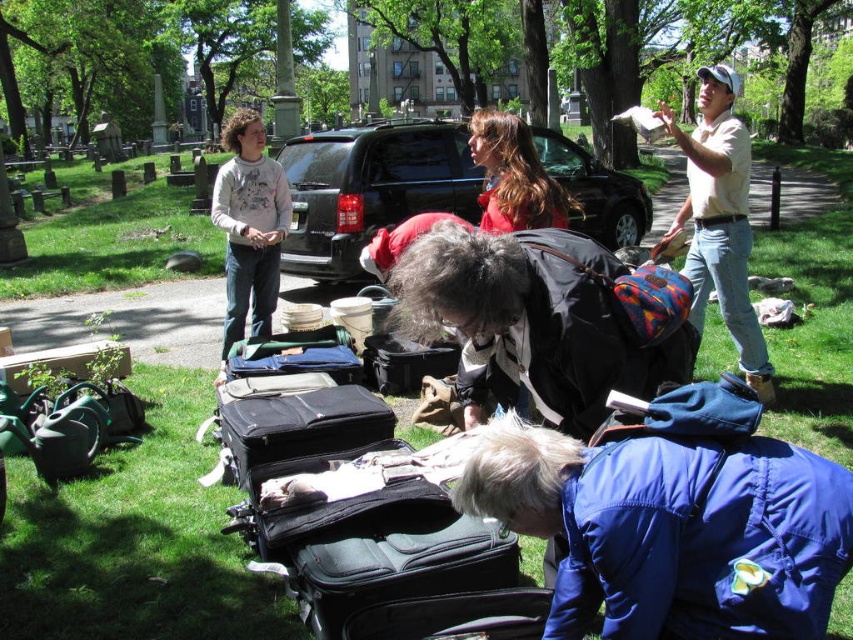
You are helping organize items in the park. You need to place the blue synthetic jacket at lower right and the white cotton sweatshirt at upper left into a storage box. If the box can only hold one item, which item should you choose based on their sizes?

The blue synthetic jacket at lower right has a smaller size compared to the white cotton sweatshirt at upper left, so you should choose the blue synthetic jacket at lower right to fit into the storage box.

You are a person who needs to retrieve an item from the blue synthetic jacket at lower right and the white cotton sweatshirt at upper left. Since both are on the grass, which item would you need to move first to access the one underneath?

The blue synthetic jacket at lower right is in front of the white cotton sweatshirt at upper left, so you would need to move the blue synthetic jacket at lower right first to access the one underneath.